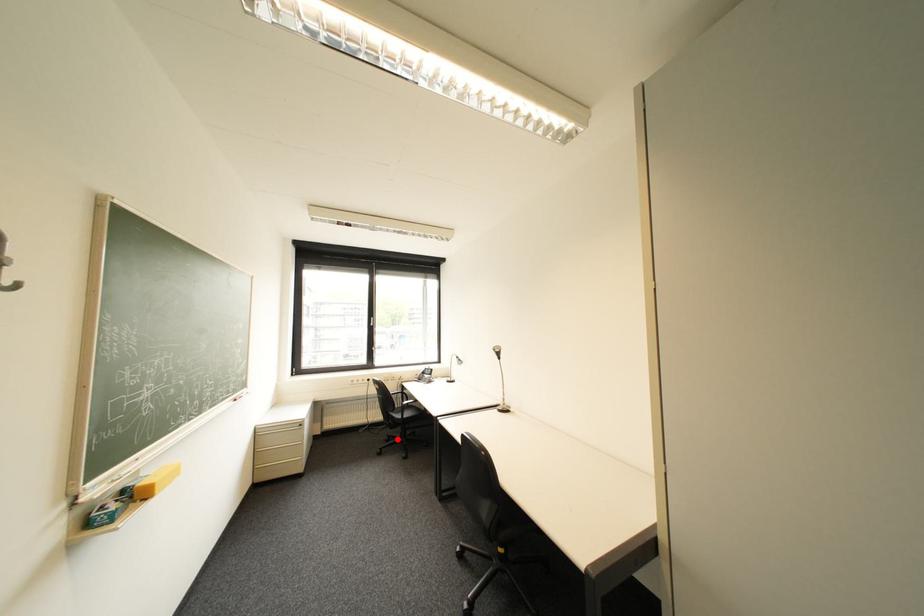
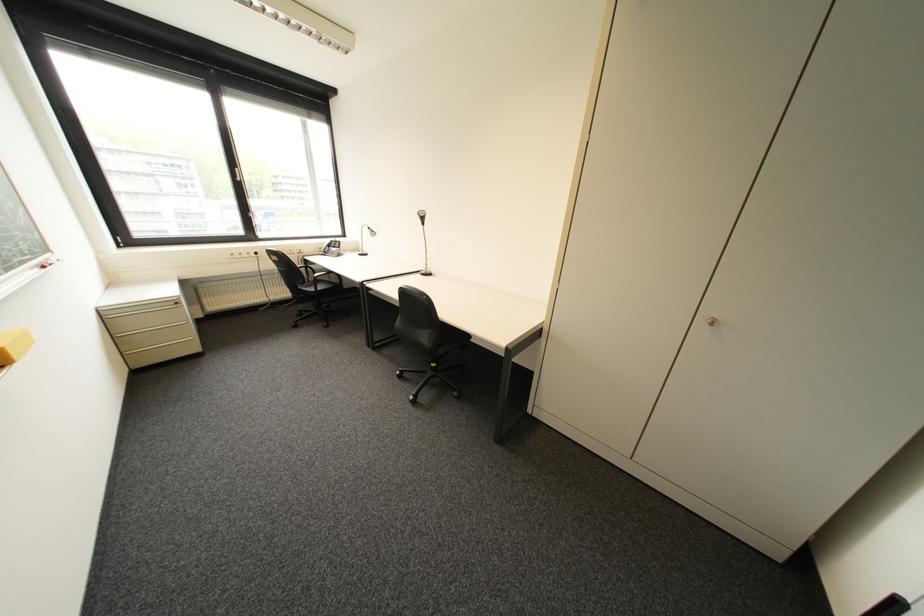
Locate, in the second image, the point that corresponds to the highlighted location in the first image.

(309, 314)